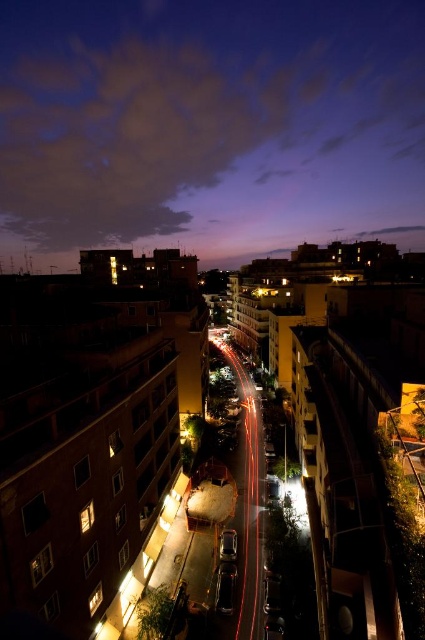
Question: Does purple sky at upper center come in front of shiny silver car at center?

Choices:
 (A) no
 (B) yes

Answer: (A)

Question: Does purple sky at upper center have a smaller size compared to shiny silver car at center?

Choices:
 (A) no
 (B) yes

Answer: (A)

Question: Is purple sky at upper center bigger than shiny silver car at center?

Choices:
 (A) yes
 (B) no

Answer: (A)

Question: Which of the following is the closest to the observer?

Choices:
 (A) purple sky at upper center
 (B) shiny silver car at center

Answer: (B)